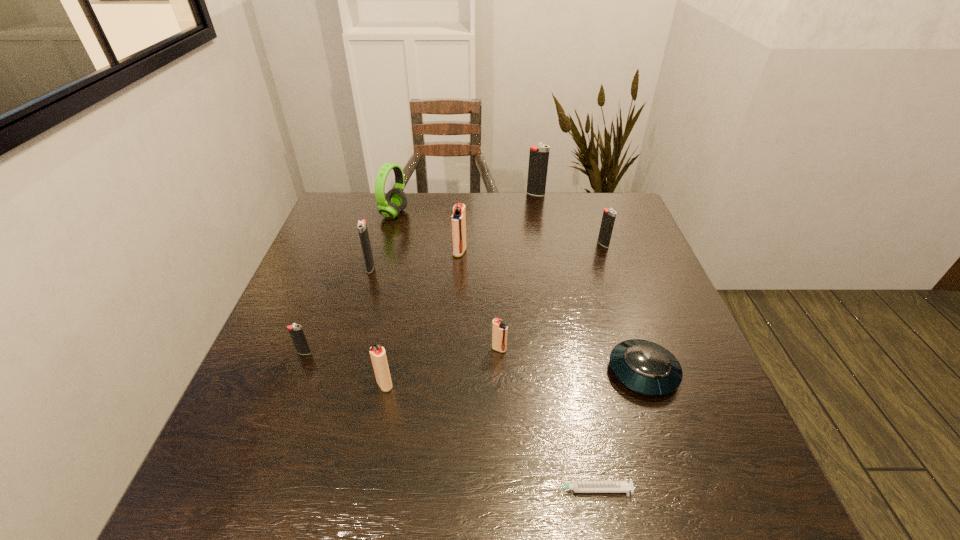
This screenshot has width=960, height=540. In order to click on free spot between the fourth igniter from right to left and the leftmost red igniter in this screenshot , I will do `click(422, 318)`.

The height and width of the screenshot is (540, 960). In order to click on free area in between the saucer and the leftmost object in this screenshot , I will do `click(473, 362)`.

This screenshot has width=960, height=540. What are the coordinates of `the third closest object relative to the smallest red igniter` in the screenshot? It's located at (577, 486).

At what (x,y) coordinates should I click in order to perform the action: click on object that can be found as the fourth closest to the leftmost igniter. Please return your answer as a coordinate pair (x, y). The height and width of the screenshot is (540, 960). Looking at the image, I should click on (458, 219).

Choose which igniter is the nearest neighbor to the biggest black igniter. Please provide its 2D coordinates. Your answer should be formatted as a tuple, i.e. [(x, y)], where the tuple contains the x and y coordinates of a point satisfying the conditions above.

[(609, 215)]

Identify which igniter is the sixth nearest to the tallest igniter. Please provide its 2D coordinates. Your answer should be formatted as a tuple, i.e. [(x, y)], where the tuple contains the x and y coordinates of a point satisfying the conditions above.

[(295, 330)]

Select which black igniter is the third closest to the second black igniter from right to left. Please provide its 2D coordinates. Your answer should be formatted as a tuple, i.e. [(x, y)], where the tuple contains the x and y coordinates of a point satisfying the conditions above.

[(295, 330)]

Choose which black igniter is the third nearest neighbor to the rightmost black igniter. Please provide its 2D coordinates. Your answer should be formatted as a tuple, i.e. [(x, y)], where the tuple contains the x and y coordinates of a point satisfying the conditions above.

[(295, 330)]

Select which red igniter is the second closest to the headset. Please provide its 2D coordinates. Your answer should be formatted as a tuple, i.e. [(x, y)], where the tuple contains the x and y coordinates of a point satisfying the conditions above.

[(499, 330)]

Locate which red igniter ranks in proximity to the green headset. Please provide its 2D coordinates. Your answer should be formatted as a tuple, i.e. [(x, y)], where the tuple contains the x and y coordinates of a point satisfying the conditions above.

[(458, 219)]